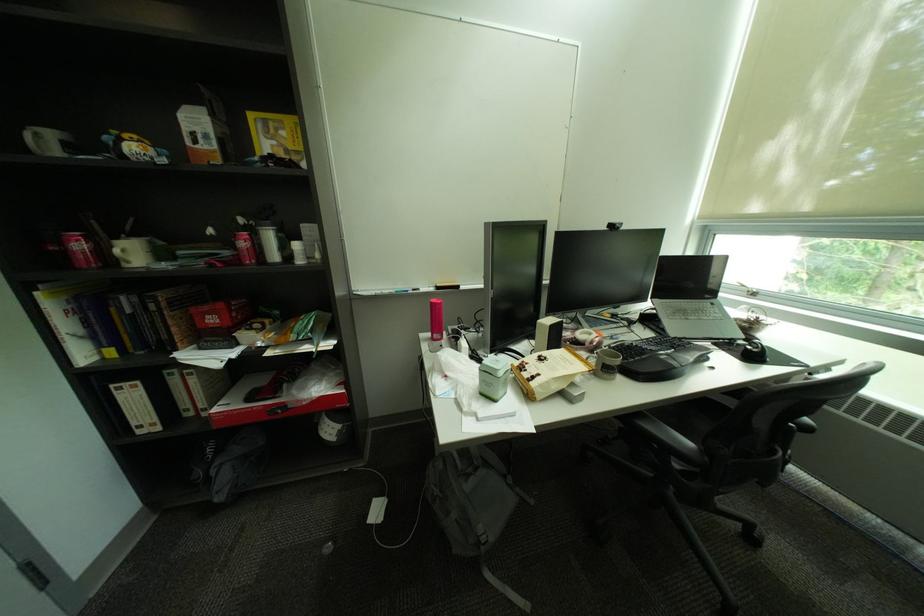
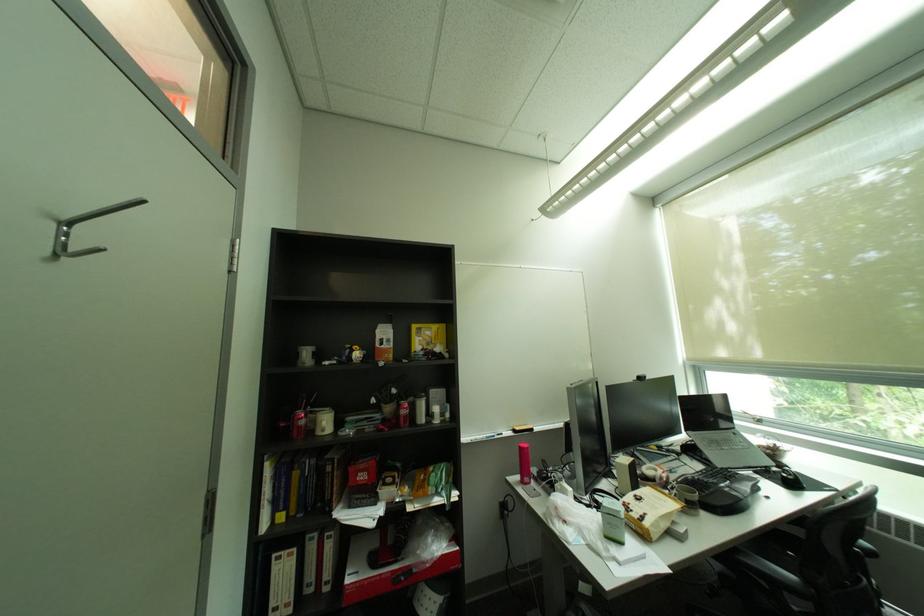
Find the pixel in the second image that matches pixel 63 249 in the first image.

(293, 426)